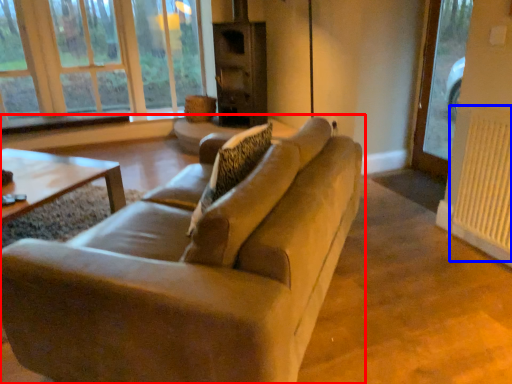
Question: Which object is further to the camera taking this photo, studio couch (highlighted by a red box) or radiator (highlighted by a blue box)?

Choices:
 (A) studio couch
 (B) radiator

Answer: (B)